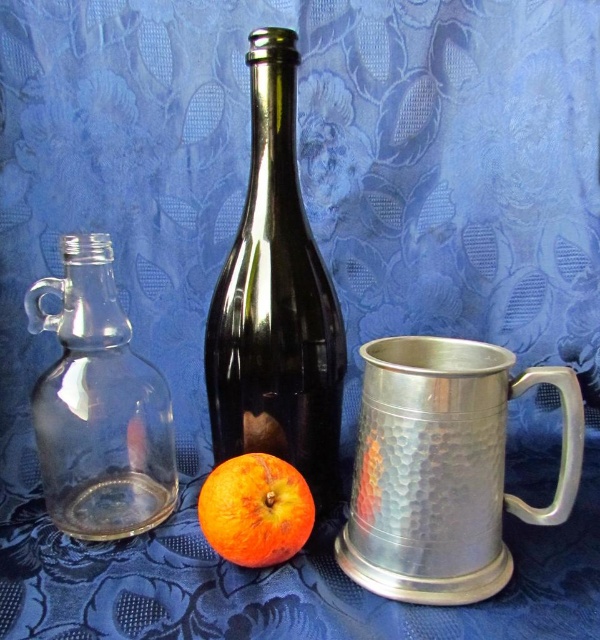
You are standing in front of the still life arrangement. There are two points marked in the image. One is at coordinates point (399, 515) and the other at point (250, 259). Which point is closer to you?

Point (399, 515) is in front of point (250, 259), so it is closer to you.

From the picture: You are an artist setting up a still life scene. You need to place a new object at position coordinates exactly halfway between the hammered silver mug at center right and the edge of the image on the left side. What are the coordinates of this midpoint?

The coordinates of the midpoint between the hammered silver mug at center right at point (444, 468) and the left edge of the image would be calculated by averaging the x and y coordinates. Since the left edge is at x coordinate 0, the midpoint x is 0.733 divided by 2, which is approximately 0.3665. The y coordinate remains 0.740. Thus, the midpoint is approximately at coordinates (444, 234).

You are setting up a table for a small gathering and need to place the hammered silver mug at center right and the shiny dark glass bottle at center. Which object is shorter?

The hammered silver mug at center right is shorter than the shiny dark glass bottle at center.